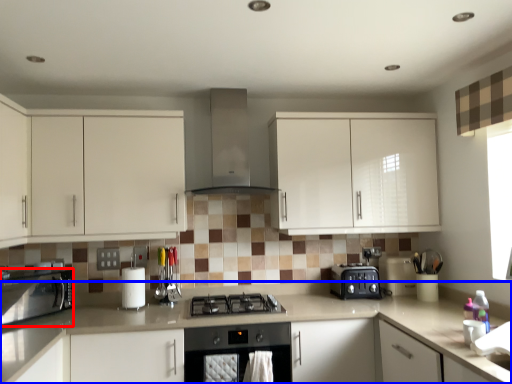
Question: Which of the following is the closest to the observer, kitchen appliance (highlighted by a red box) or countertop (highlighted by a blue box)?

Choices:
 (A) kitchen appliance
 (B) countertop

Answer: (B)